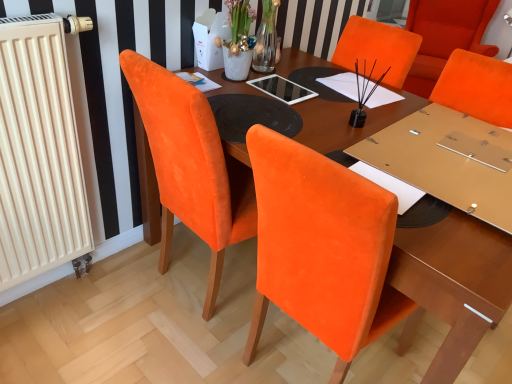
Question: Does velvet orange chair at upper right have a lesser width compared to wooden table at center?

Choices:
 (A) no
 (B) yes

Answer: (B)

Question: Does velvet orange chair at upper right have a greater width compared to wooden table at center?

Choices:
 (A) no
 (B) yes

Answer: (A)

Question: Considering the relative sizes of velvet orange chair at upper right and wooden table at center in the image provided, is velvet orange chair at upper right smaller than wooden table at center?

Choices:
 (A) no
 (B) yes

Answer: (B)

Question: Could wooden table at center be considered to be inside velvet orange chair at upper right?

Choices:
 (A) yes
 (B) no

Answer: (B)

Question: From a real-world perspective, is velvet orange chair at upper right physically above wooden table at center?

Choices:
 (A) yes
 (B) no

Answer: (A)

Question: Is wooden table at center in front of or behind beige radiator at left in the image?

Choices:
 (A) behind
 (B) front

Answer: (B)

Question: Visually, is wooden table at center positioned to the left or to the right of beige radiator at left?

Choices:
 (A) right
 (B) left

Answer: (A)

Question: Is point (153, 195) positioned closer to the camera than point (39, 140)?

Choices:
 (A) farther
 (B) closer

Answer: (A)

Question: In terms of width, does wooden table at center look wider or thinner when compared to beige radiator at left?

Choices:
 (A) wide
 (B) thin

Answer: (A)

Question: From a real-world perspective, is beige radiator at left positioned above or below velvet orange chair at upper right?

Choices:
 (A) above
 (B) below

Answer: (A)

Question: In the image, is beige radiator at left positioned in front of or behind velvet orange chair at upper right?

Choices:
 (A) front
 (B) behind

Answer: (A)

Question: Is beige radiator at left inside or outside of velvet orange chair at upper right?

Choices:
 (A) outside
 (B) inside

Answer: (A)

Question: From the image's perspective, relative to velvet orange chair at upper right, is beige radiator at left above or below?

Choices:
 (A) above
 (B) below

Answer: (B)

Question: Is wooden table at center taller or shorter than velvet orange chair at upper right?

Choices:
 (A) short
 (B) tall

Answer: (A)

Question: Is wooden table at center to the left or to the right of velvet orange chair at upper right in the image?

Choices:
 (A) right
 (B) left

Answer: (B)